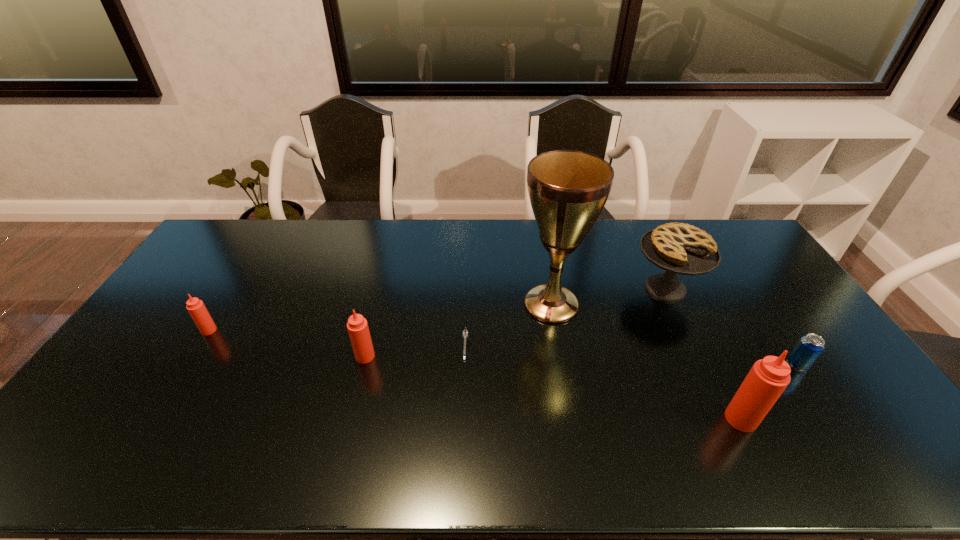
What are the coordinates of `free space between the trophy cup and the pie` in the screenshot? It's located at (609, 296).

The height and width of the screenshot is (540, 960). I want to click on free space between the beer can and the trophy cup, so click(675, 334).

Identify the location of empty location between the trophy cup and the leftmost object. (380, 317).

What are the coordinates of `vacant area between the second Tabasco sauce from right to left and the trophy cup` in the screenshot? It's located at pyautogui.click(x=458, y=330).

In order to click on vacant space in between the fifth object from right to left and the second shortest object in this screenshot , I will do [x=632, y=358].

Image resolution: width=960 pixels, height=540 pixels. I want to click on vacant space in between the rightmost object and the second tallest Tabasco sauce, so click(x=582, y=360).

Where is `vacant space in between the second Tabasco sauce from left to right and the third shortest object`? vacant space in between the second Tabasco sauce from left to right and the third shortest object is located at coordinates (287, 343).

Locate an element on the screen. This screenshot has height=540, width=960. object that is the closest one to the leftmost Tabasco sauce is located at coordinates (357, 325).

The height and width of the screenshot is (540, 960). In order to click on object that stands as the closest to the pie in this screenshot , I will do [x=568, y=189].

Choose which Tabasco sauce is the nearest neighbor to the tallest Tabasco sauce. Please provide its 2D coordinates. Your answer should be formatted as a tuple, i.e. [(x, y)], where the tuple contains the x and y coordinates of a point satisfying the conditions above.

[(357, 325)]